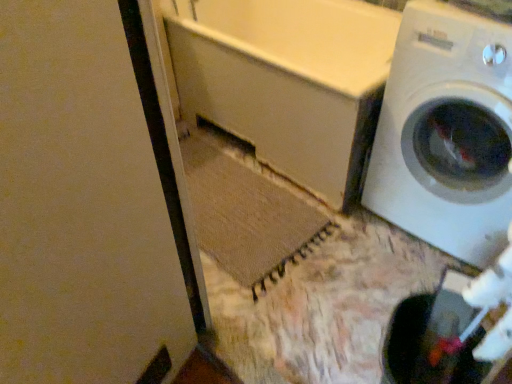
Describe the element at coordinates (287, 81) in the screenshot. I see `white matte bathtub at center` at that location.

What is the approximate height of white matte bathtub at center?

It is 23.24 inches.

At what (x,y) coordinates should I click in order to perform the action: click on white matte bathtub at center. Please return your answer as a coordinate pair (x, y). The width and height of the screenshot is (512, 384). Looking at the image, I should click on (287, 81).

Considering the positions of objects white glossy washing machine at right and white matte bathtub at center in the image provided, who is more to the left, white glossy washing machine at right or white matte bathtub at center?

white matte bathtub at center.

Looking at their sizes, would you say white glossy washing machine at right is wider or thinner than white matte bathtub at center?

In the image, white glossy washing machine at right appears to be more narrow than white matte bathtub at center.

Looking at this image, is white glossy washing machine at right oriented towards white matte bathtub at center?

No, white glossy washing machine at right is not turned towards white matte bathtub at center.

Considering their positions, is white glossy washing machine at right located in front of or behind white matte screen door at upper left?

Visually, white glossy washing machine at right is located behind white matte screen door at upper left.

Does white glossy washing machine at right have a lesser width compared to white matte screen door at upper left?

Incorrect, the width of white glossy washing machine at right is not less than that of white matte screen door at upper left.

Considering the sizes of objects white glossy washing machine at right and white matte screen door at upper left in the image provided, who is taller, white glossy washing machine at right or white matte screen door at upper left?

Standing taller between the two is white matte screen door at upper left.

How far apart are white matte bathtub at center and white glossy washing machine at right?

13.98 inches.

Which is correct: white matte bathtub at center is inside white glossy washing machine at right, or outside of it?

white matte bathtub at center exists outside the volume of white glossy washing machine at right.

Is white matte bathtub at center further to camera compared to white glossy washing machine at right?

Yes, white matte bathtub at center is further from the viewer.

Is white matte bathtub at center next to white glossy washing machine at right and touching it?

No, white matte bathtub at center is not in contact with white glossy washing machine at right.

Is white matte screen door at upper left positioned with its back to white glossy washing machine at right?

No.

Is white matte screen door at upper left not near white glossy washing machine at right?

That's right, there is a large distance between white matte screen door at upper left and white glossy washing machine at right.

Is white matte screen door at upper left further to the viewer compared to white glossy washing machine at right?

No.

Based on the photo, is white matte bathtub at center facing towards white matte screen door at upper left?

Yes, white matte bathtub at center is oriented towards white matte screen door at upper left.

Considering the sizes of objects white matte bathtub at center and white matte screen door at upper left in the image provided, who is bigger, white matte bathtub at center or white matte screen door at upper left?

white matte bathtub at center is bigger.

Is white matte bathtub at center not within white matte screen door at upper left?

white matte bathtub at center lies outside white matte screen door at upper left's area.

Does white matte bathtub at center have a lesser height compared to white matte screen door at upper left?

Yes.

Is white matte screen door at upper left turned away from white matte bathtub at center?

No, white matte screen door at upper left's orientation is not away from white matte bathtub at center.

In order to click on screen door located below the white matte bathtub at center (from the image's perspective) in this screenshot , I will do `click(87, 202)`.

From the image's perspective, is white matte screen door at upper left on top of white matte bathtub at center?

No.

Locate an element on the screen. This screenshot has height=384, width=512. washing machine located in front of the white matte bathtub at center is located at coordinates (446, 133).

The width and height of the screenshot is (512, 384). I want to click on screen door below the white glossy washing machine at right (from the image's perspective), so click(x=87, y=202).

Based on their spatial positions, is white matte screen door at upper left or white glossy washing machine at right further from white matte bathtub at center?

white matte screen door at upper left is further to white matte bathtub at center.

Which object lies further to the anchor point white glossy washing machine at right, white matte bathtub at center or white matte screen door at upper left?

Based on the image, white matte screen door at upper left appears to be further to white glossy washing machine at right.

Looking at the image, which one is located closer to white matte bathtub at center, white glossy washing machine at right or white matte screen door at upper left?

white glossy washing machine at right.

Based on their spatial positions, is white matte screen door at upper left or white matte bathtub at center further from white glossy washing machine at right?

white matte screen door at upper left lies further to white glossy washing machine at right than the other object.

Based on their spatial positions, is white glossy washing machine at right or white matte bathtub at center closer to white matte screen door at upper left?

white matte bathtub at center lies closer to white matte screen door at upper left than the other object.

Which object lies further to the anchor point white matte screen door at upper left, white matte bathtub at center or white glossy washing machine at right?

white glossy washing machine at right is positioned further to the anchor white matte screen door at upper left.

What are the coordinates of `washing machine between white matte screen door at upper left and white matte bathtub at center from front to back` in the screenshot? It's located at (446, 133).